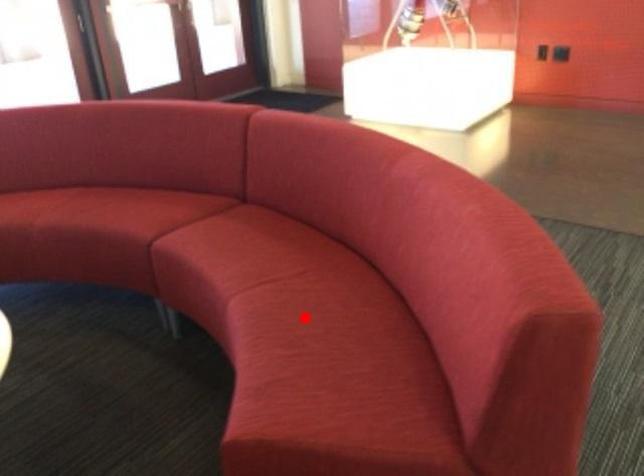
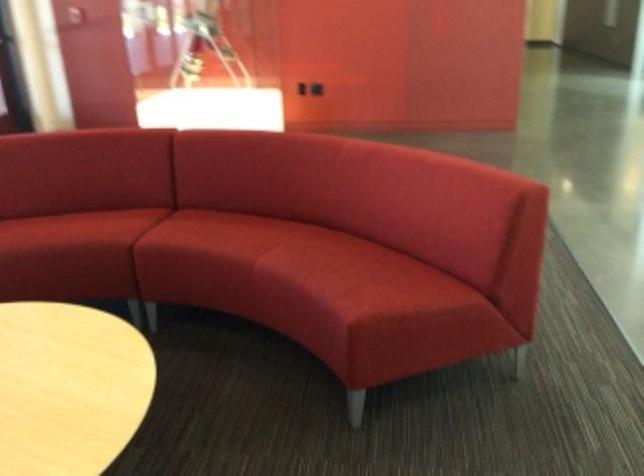
Find the pixel in the second image that matches the highlighted location in the first image.

(328, 258)